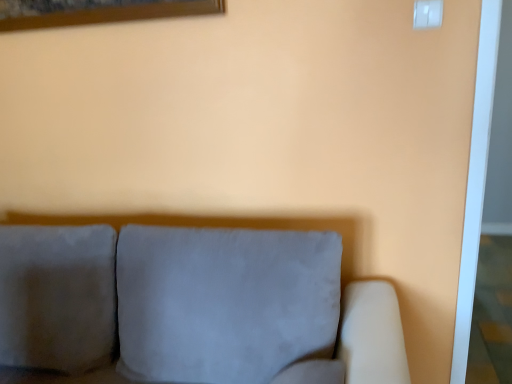
Question: In terms of height, does suede gray couch at center look taller or shorter compared to white plastic switch at upper right?

Choices:
 (A) short
 (B) tall

Answer: (B)

Question: Is suede gray couch at center inside the boundaries of white plastic switch at upper right, or outside?

Choices:
 (A) inside
 (B) outside

Answer: (B)

Question: Relative to white plastic switch at upper right, is suede gray couch at center in front or behind?

Choices:
 (A) front
 (B) behind

Answer: (A)

Question: Visually, is white plastic switch at upper right positioned to the left or to the right of suede gray couch at center?

Choices:
 (A) left
 (B) right

Answer: (B)

Question: Is white plastic switch at upper right bigger or smaller than suede gray couch at center?

Choices:
 (A) big
 (B) small

Answer: (B)

Question: Considering the positions of white plastic switch at upper right and suede gray couch at center in the image, is white plastic switch at upper right taller or shorter than suede gray couch at center?

Choices:
 (A) tall
 (B) short

Answer: (B)

Question: Considering the positions of white plastic switch at upper right and suede gray couch at center in the image, is white plastic switch at upper right wider or thinner than suede gray couch at center?

Choices:
 (A) thin
 (B) wide

Answer: (A)